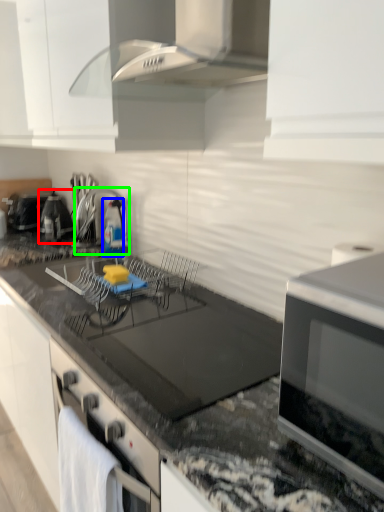
Question: Based on their relative distances, which object is farther from appliance (highlighted by a red box)? Choose from bottle (highlighted by a blue box) and appliance (highlighted by a green box).

Choices:
 (A) bottle
 (B) appliance

Answer: (A)